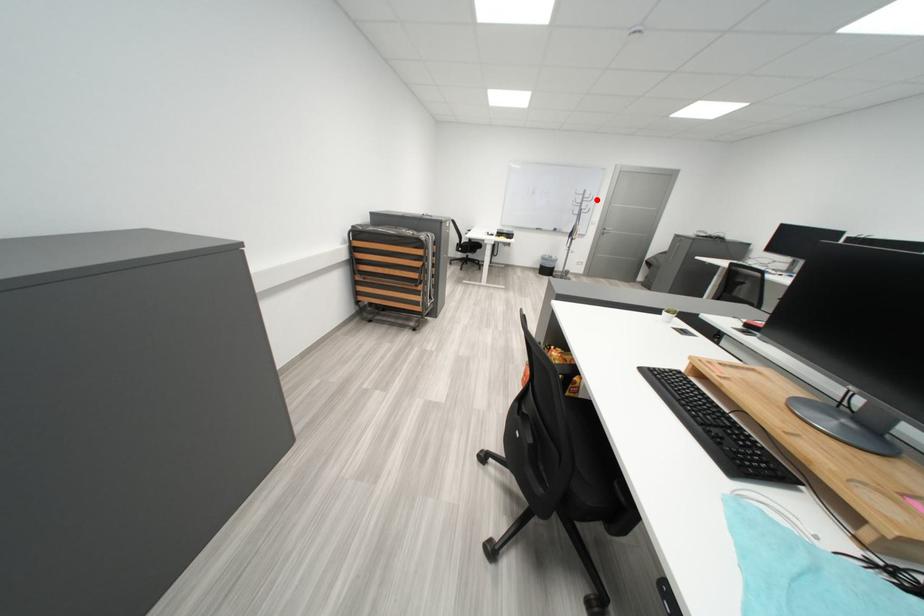
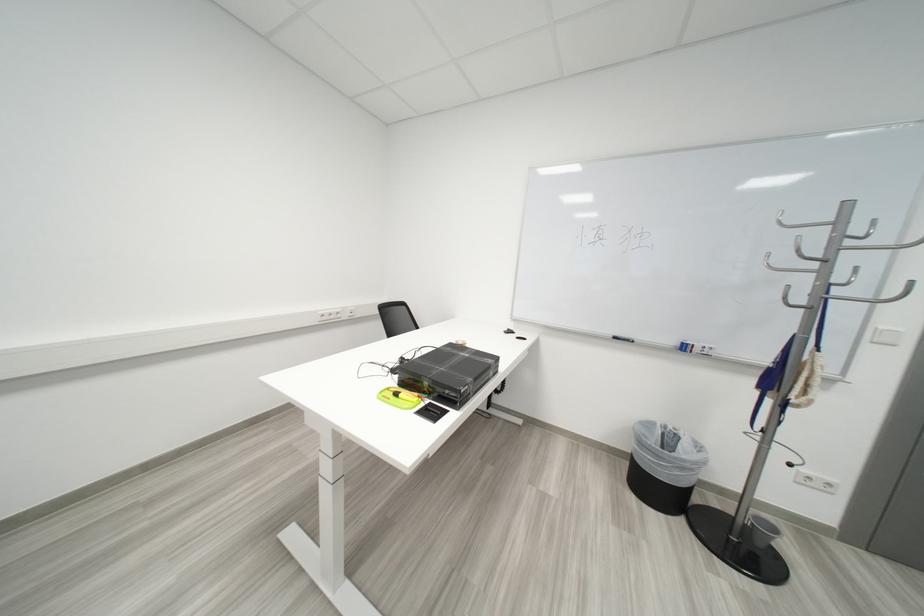
Question: I am providing you with two images of the same scene from different viewpoints. Given a red point in image1, look at the same physical point in image2. Is it:

Choices:
 (A) Closer to the viewpoint
 (B) Farther from the viewpoint

Answer: (B)